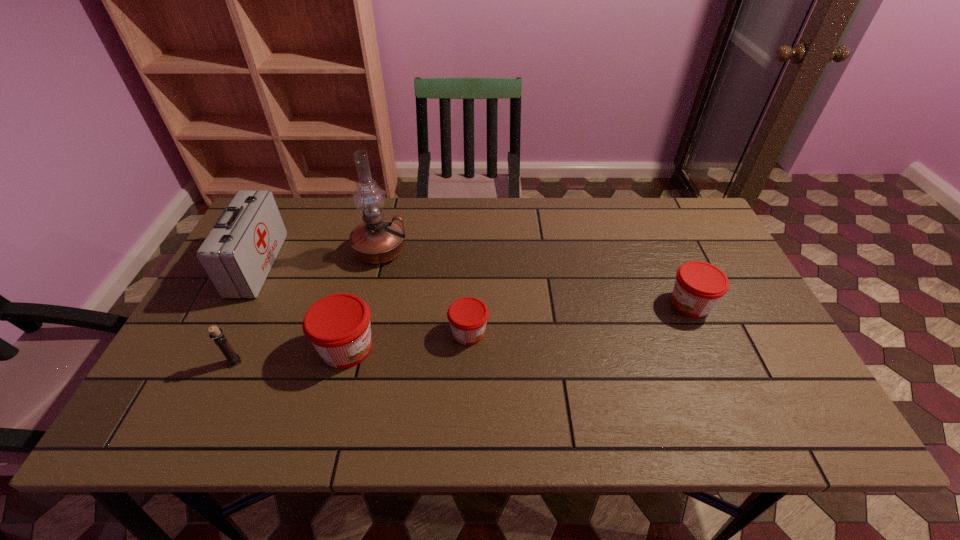
The image size is (960, 540). In order to click on candle holder at the near edge in this screenshot , I will do `click(233, 359)`.

Where is `the first-aid kit that is at the left edge`? This screenshot has height=540, width=960. the first-aid kit that is at the left edge is located at coordinates (237, 255).

At what (x,y) coordinates should I click in order to perform the action: click on candle holder present at the left edge. Please return your answer as a coordinate pair (x, y). This screenshot has width=960, height=540. Looking at the image, I should click on (233, 359).

You are a GUI agent. You are given a task and a screenshot of the screen. Output one action in this format:
    pyautogui.click(x=<x>, y=<y>)
    Task: Click on the object positioned at the right edge
    
    Given the screenshot: What is the action you would take?
    pyautogui.click(x=699, y=286)

I want to click on object located in the far left corner section of the desktop, so click(x=237, y=255).

Where is `object situated at the near left corner`? This screenshot has height=540, width=960. object situated at the near left corner is located at coordinates (233, 359).

Find the location of a particular element. This screenshot has width=960, height=540. free space at the far edge of the desktop is located at coordinates (478, 230).

In the image, there is a desktop. Identify the location of vacant space at the near edge. This screenshot has height=540, width=960. pos(296,364).

Find the location of a particular element. The width and height of the screenshot is (960, 540). vacant point at the left edge is located at coordinates (211, 361).

At what (x,y) coordinates should I click in order to perform the action: click on vacant space at the right edge. Please return your answer as a coordinate pair (x, y). Image resolution: width=960 pixels, height=540 pixels. Looking at the image, I should click on (675, 258).